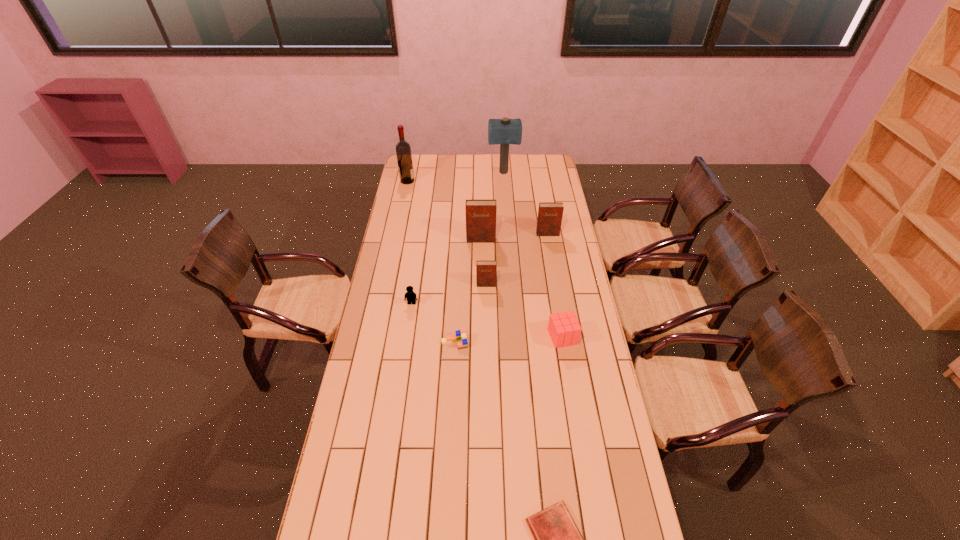
Find the location of a particular element. This screenshot has height=540, width=960. free location located on the front-facing side of the left Lego is located at coordinates (399, 387).

Locate an element on the screen. free space located 0.260m on the front of the nearer Lego is located at coordinates (451, 410).

You are a GUI agent. You are given a task and a screenshot of the screen. Output one action in this format:
    pyautogui.click(x=<x>, y=<y>)
    Task: Click on the object at the far edge
    Image resolution: width=960 pixels, height=540 pixels.
    Given the screenshot: What is the action you would take?
    pyautogui.click(x=505, y=131)

In order to click on alcohol located in the left edge section of the desktop in this screenshot , I will do `click(403, 150)`.

This screenshot has width=960, height=540. In order to click on Lego at the left edge in this screenshot , I will do pos(410,296).

The width and height of the screenshot is (960, 540). I want to click on diary located at the right edge, so click(550, 214).

The width and height of the screenshot is (960, 540). What are the coordinates of `cube that is positioned at the right edge` in the screenshot? It's located at (564, 329).

Locate an element on the screen. The image size is (960, 540). free space at the far edge of the desktop is located at coordinates (436, 168).

Locate an element on the screen. The height and width of the screenshot is (540, 960). vacant region at the left edge of the desktop is located at coordinates (344, 462).

You are a GUI agent. You are given a task and a screenshot of the screen. Output one action in this format:
    pyautogui.click(x=<x>, y=<y>)
    Task: Click on the free space at the right edge of the desktop
    Image resolution: width=960 pixels, height=540 pixels.
    Given the screenshot: What is the action you would take?
    pyautogui.click(x=542, y=191)